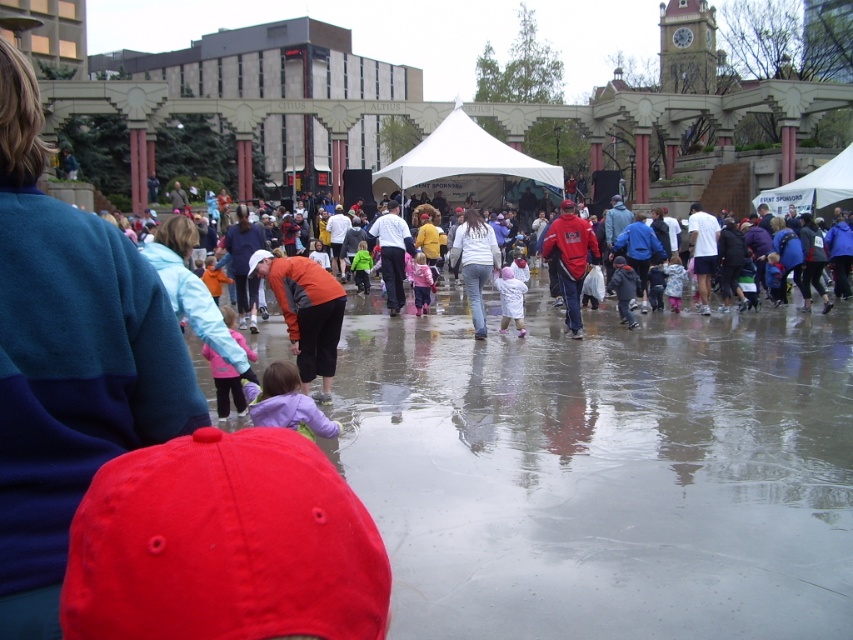
Is purple fleece jacket at center thinner than pink rubber boots at center?

Incorrect, purple fleece jacket at center's width is not less than pink rubber boots at center's.

What do you see at coordinates (286, 403) in the screenshot?
I see `purple fleece jacket at center` at bounding box center [286, 403].

You are a GUI agent. You are given a task and a screenshot of the screen. Output one action in this format:
    pyautogui.click(x=<x>, y=<y>)
    Task: Click on the purple fleece jacket at center
    
    Given the screenshot: What is the action you would take?
    pyautogui.click(x=286, y=403)

Is point (283, 300) behind point (418, 285)?

No, (283, 300) is closer to viewer.

Between orange fabric jacket at center and pink rubber boots at center, which one is positioned higher?

pink rubber boots at center is above.

Is point (300, 378) positioned in front of point (430, 280)?

Yes, it is.

The height and width of the screenshot is (640, 853). Identify the location of orange fabric jacket at center. (305, 312).

Is the position of white fabric tent at center more distant than that of white matte coat at center?

That is True.

Is white fabric tent at center shorter than white matte coat at center?

No.

At what (x,y) coordinates should I click in order to perform the action: click on white fabric tent at center. Please return your answer as a coordinate pair (x, y). Looking at the image, I should click on (463, 156).